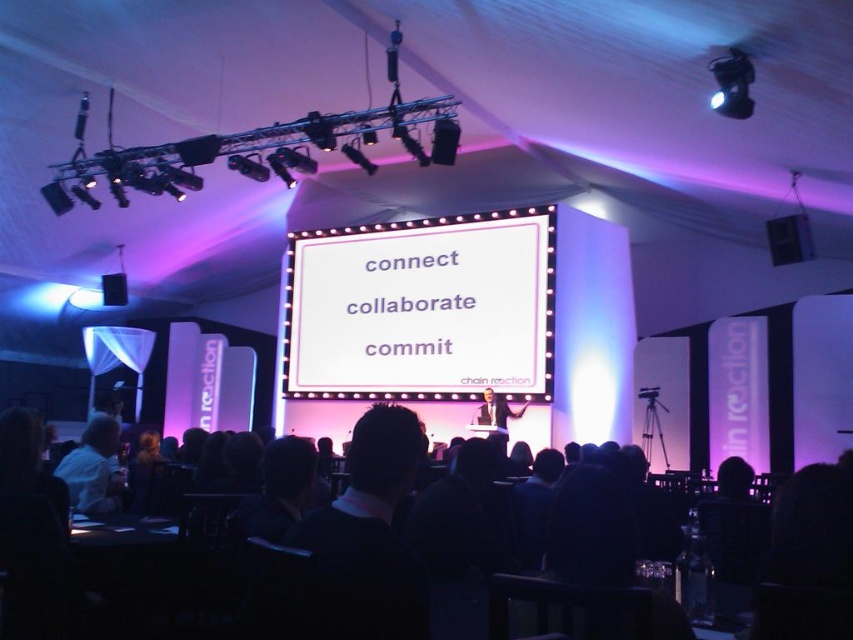
Question: Does white matte projection screen at center appear on the right side of black matte speaker at upper left?

Choices:
 (A) no
 (B) yes

Answer: (B)

Question: Among these points, which one is farthest from the camera?

Choices:
 (A) (490, 396)
 (B) (102, 282)

Answer: (B)

Question: Considering the real-world distances, which object is farthest from the black matte speaker at upper right?

Choices:
 (A) white matte projection screen at center
 (B) light brown wooden podium at center
 (C) black matte speaker at upper left

Answer: (C)

Question: Is light brown wooden podium at center smaller than black matte speaker at upper left?

Choices:
 (A) yes
 (B) no

Answer: (B)

Question: Is black fabric chairs at lower center smaller than matte black speaker at upper center?

Choices:
 (A) no
 (B) yes

Answer: (A)

Question: Which point is farther from the camera taking this photo?

Choices:
 (A) (453, 141)
 (B) (360, 250)
 (C) (482, 408)

Answer: (B)